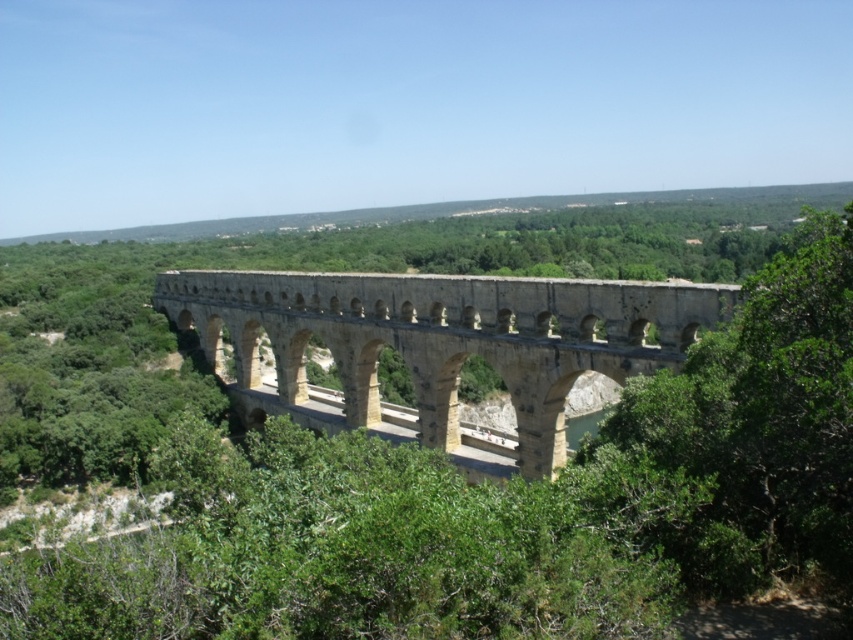
Question: Which of the following is the farthest from the observer?

Choices:
 (A) stone arch bridge at center
 (B) green leafy tree at center

Answer: (A)

Question: Is green leafy tree at center to the left of stone arch bridge at center from the viewer's perspective?

Choices:
 (A) yes
 (B) no

Answer: (B)

Question: Which point is farther from the camera taking this photo?

Choices:
 (A) (369, 401)
 (B) (416, 524)

Answer: (A)

Question: In this image, where is green leafy tree at center located relative to stone arch bridge at center?

Choices:
 (A) left
 (B) right

Answer: (B)

Question: Is green leafy tree at center wider than stone arch bridge at center?

Choices:
 (A) yes
 (B) no

Answer: (B)